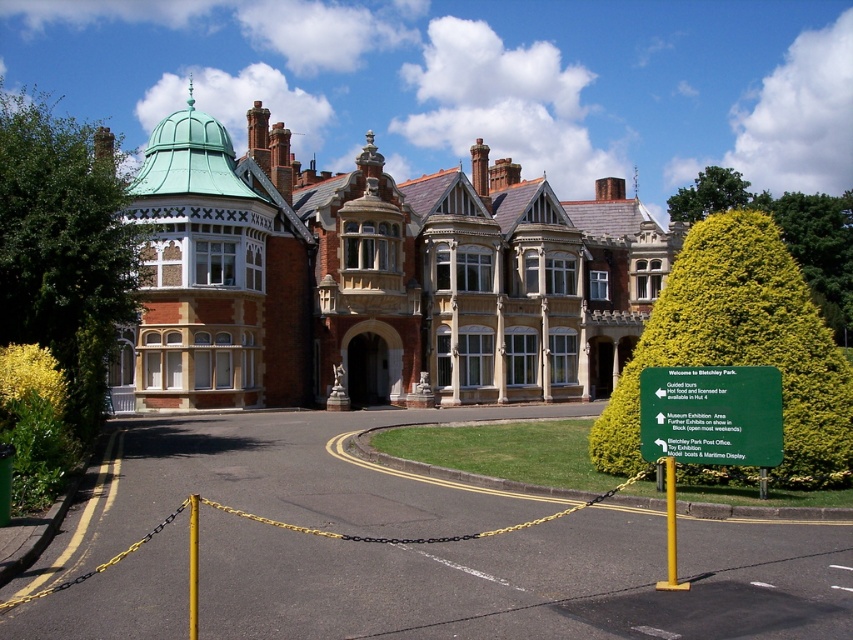
Measure the distance between green leafy tree at upper left and green leafy tree at upper center.

green leafy tree at upper left and green leafy tree at upper center are 99.86 meters apart.

Can you confirm if green leafy tree at upper left is shorter than green leafy tree at upper center?

Incorrect, green leafy tree at upper left's height does not fall short of green leafy tree at upper center's.

Is point (67, 227) behind point (733, 208)?

No, it is in front of (733, 208).

Identify the location of green leafy tree at upper left. (62, 246).

Does brick mansion at center lie in front of green plastic signpost at center?

That is False.

Between point (509, 349) and point (775, 401), which one is positioned behind?

The point (509, 349) is behind.

What are the coordinates of `brick mansion at center` in the screenshot? It's located at (376, 276).

You are a GUI agent. You are given a task and a screenshot of the screen. Output one action in this format:
    pyautogui.click(x=<x>, y=<y>)
    Task: Click on the brick mansion at center
    
    Given the screenshot: What is the action you would take?
    pyautogui.click(x=376, y=276)

Does green plastic signpost at center have a lesser height compared to yellow textured hedge at upper right?

Correct, green plastic signpost at center is not as tall as yellow textured hedge at upper right.

Measure the distance between green plastic signpost at center and camera.

green plastic signpost at center is 51.41 feet from camera.

Where is `green plastic signpost at center`? Image resolution: width=853 pixels, height=640 pixels. green plastic signpost at center is located at coordinates (706, 426).